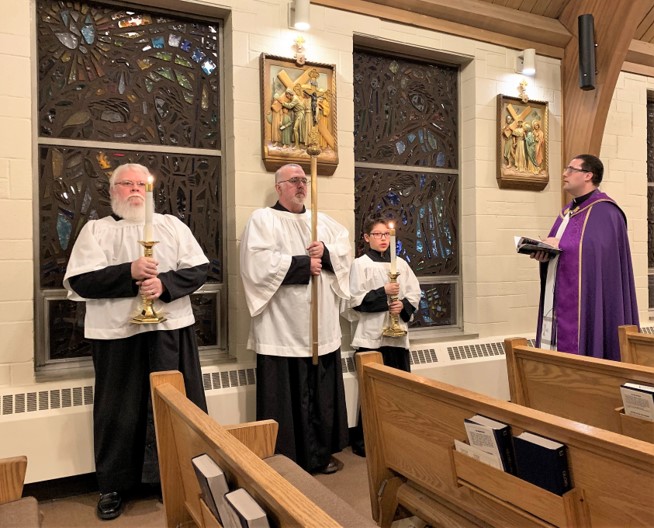
What are the coordinates of `shoe` in the screenshot? It's located at (337, 465), (108, 512).